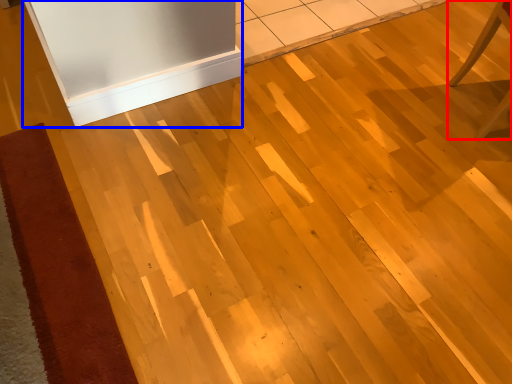
Question: Which object is closer to the camera taking this photo, furniture (highlighted by a red box) or fridge (highlighted by a blue box)?

Choices:
 (A) furniture
 (B) fridge

Answer: (A)